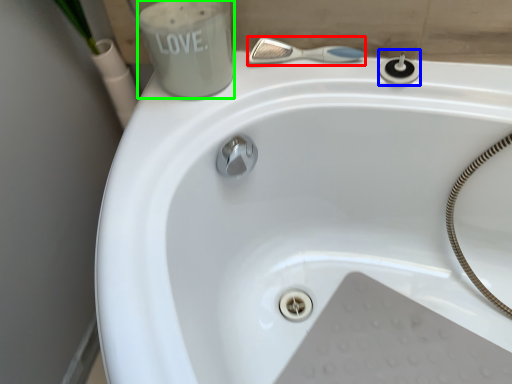
Question: Considering the real-world distances, which object is closest to shower (highlighted by a red box)? plumbing fixture (highlighted by a blue box) or liquid (highlighted by a green box).

Choices:
 (A) plumbing fixture
 (B) liquid

Answer: (A)